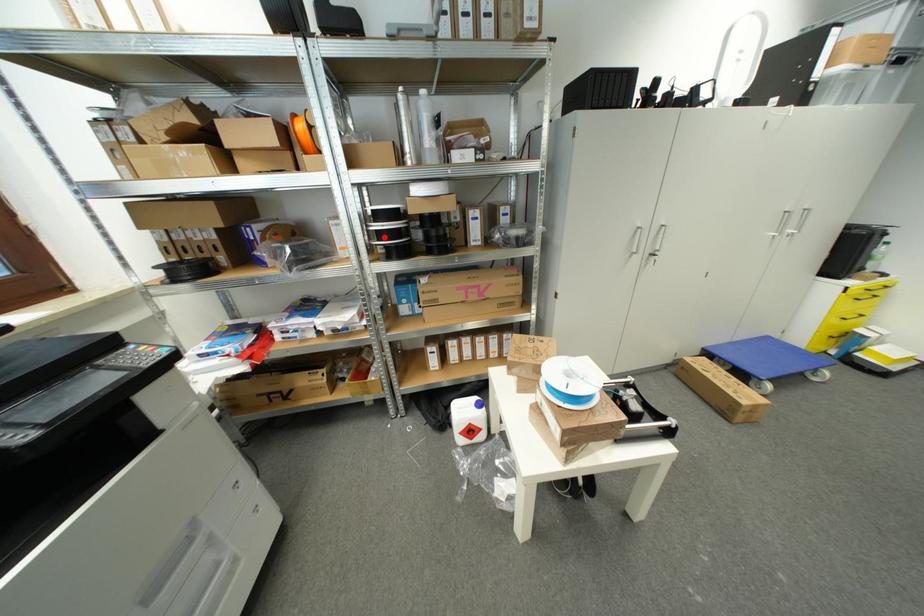
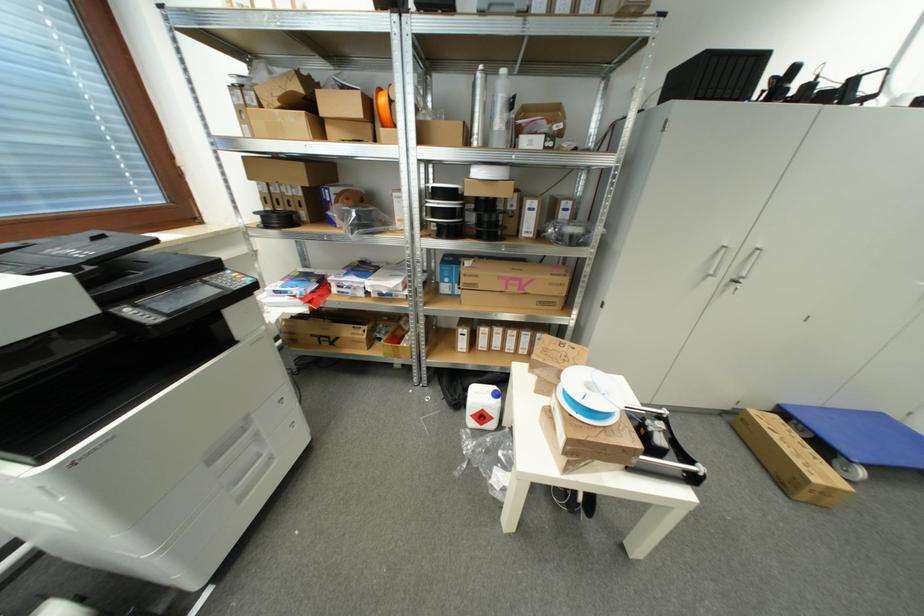
The point at the highlighted location is marked in the first image. Where is the corresponding point in the second image?

(439, 215)